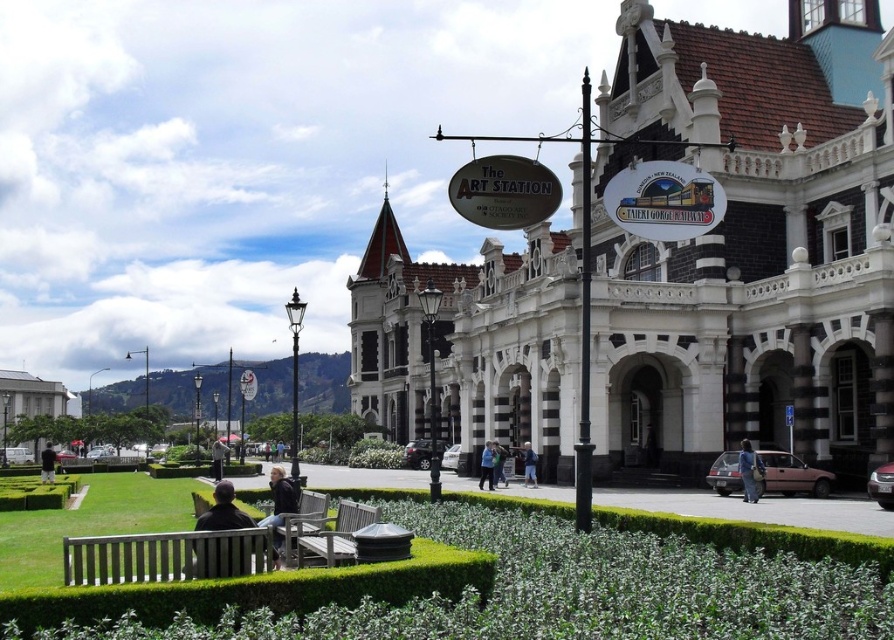
From the picture: Is matte pink car at lower right bigger than wooden bench at center?

Yes, matte pink car at lower right is bigger than wooden bench at center.

Consider the image. Does matte pink car at lower right have a lesser width compared to wooden bench at center?

In fact, matte pink car at lower right might be wider than wooden bench at center.

Is point (787, 458) closer to camera compared to point (326, 563)?

No, (787, 458) is behind (326, 563).

The width and height of the screenshot is (894, 640). Identify the location of matte pink car at lower right. (790, 476).

Which is more to the right, wooden bench at center or light blue denim jacket at center?

From the viewer's perspective, light blue denim jacket at center appears more on the right side.

Between point (325, 547) and point (527, 468), which one is positioned behind?

Positioned behind is point (527, 468).

Where is `wooden bench at center`? The height and width of the screenshot is (640, 894). wooden bench at center is located at coordinates coord(335,536).

Who is lower down, green hedge at center or wooden slats bench at lower left?

green hedge at center is below.

Is green hedge at center bigger than wooden slats bench at lower left?

Indeed, green hedge at center has a larger size compared to wooden slats bench at lower left.

Which is behind, point (529, 579) or point (221, 573)?

The point (529, 579) is behind.

Find the location of a particular element. green hedge at center is located at coordinates (576, 589).